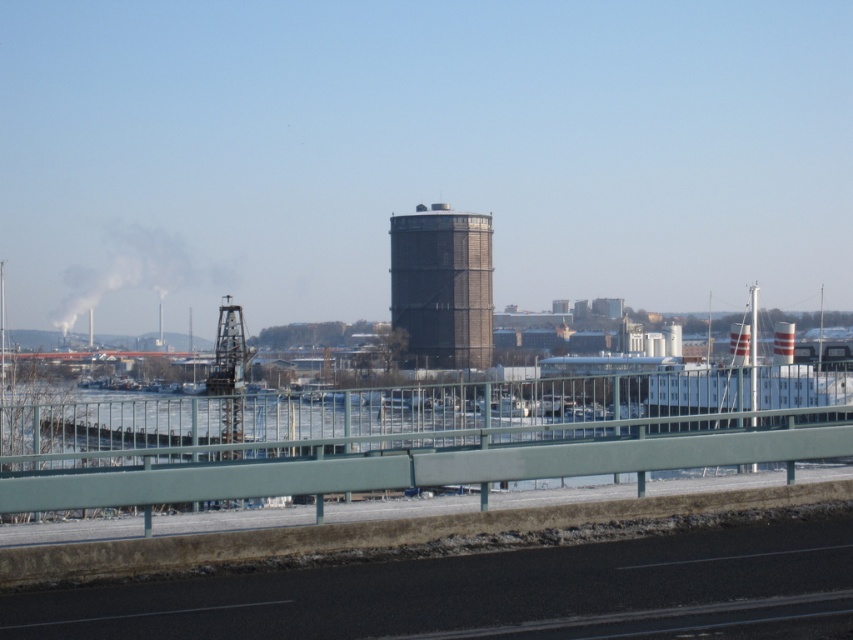
Question: Can you confirm if green metal railing at lower center is positioned to the right of dark gray metallic silo at center?

Choices:
 (A) yes
 (B) no

Answer: (A)

Question: Which object is farther from the camera taking this photo?

Choices:
 (A) smoketransparent at left
 (B) green metal railing at lower center
 (C) dark gray metallic silo at center

Answer: (A)

Question: Is dark gray metallic silo at center bigger than smoketransparent at left?

Choices:
 (A) no
 (B) yes

Answer: (A)

Question: Which point is closer to the camera?

Choices:
 (A) black asphalt highway at lower center
 (B) green metal railing at lower center
 (C) dark gray metallic silo at center

Answer: (A)

Question: Can you confirm if black asphalt highway at lower center is smaller than smoketransparent at left?

Choices:
 (A) no
 (B) yes

Answer: (B)

Question: Among these objects, which one is farthest from the camera?

Choices:
 (A) smoketransparent at left
 (B) dark gray metallic silo at center

Answer: (A)